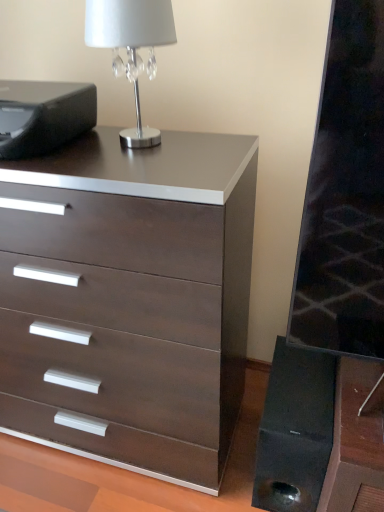
At what (x,y) coordinates should I click in order to perform the action: click on vacant position to the left of black matte speaker at lower right. Please return your answer as a coordinate pair (x, y). This screenshot has width=384, height=512. Looking at the image, I should click on (226, 473).